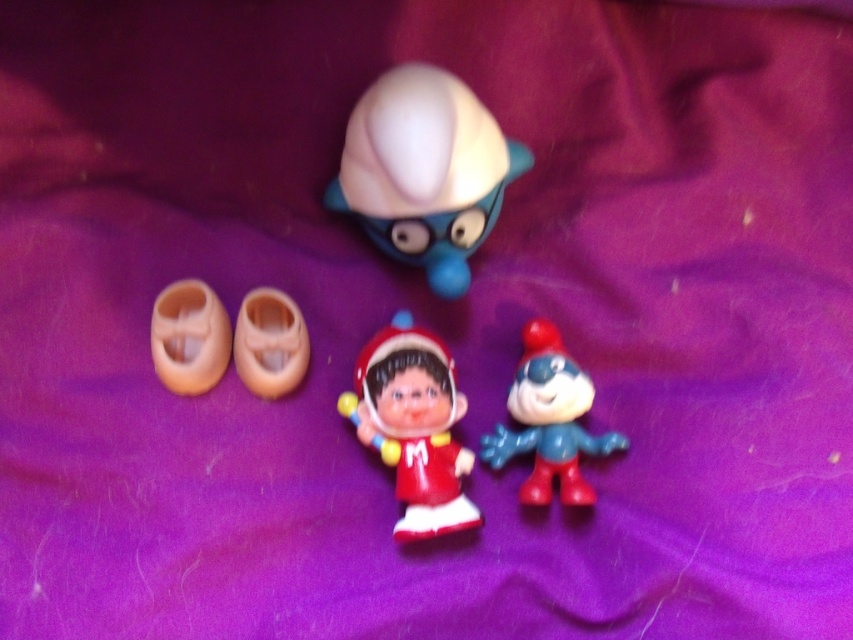
You are organizing a display of small items and need to know the relative positions of the matte plastic toy at upper center and the beige rubber shoes at lower left. Which one is positioned higher in the image?

The matte plastic toy at upper center is located above the beige rubber shoes at lower left, so it is positioned higher in the image.

You are looking at the image of figurines on a purple fabric background. There is a point at coordinate [424,172]. Which object does this point belong to?

The point at coordinate [424,172] belongs to the matte plastic toy at upper center.